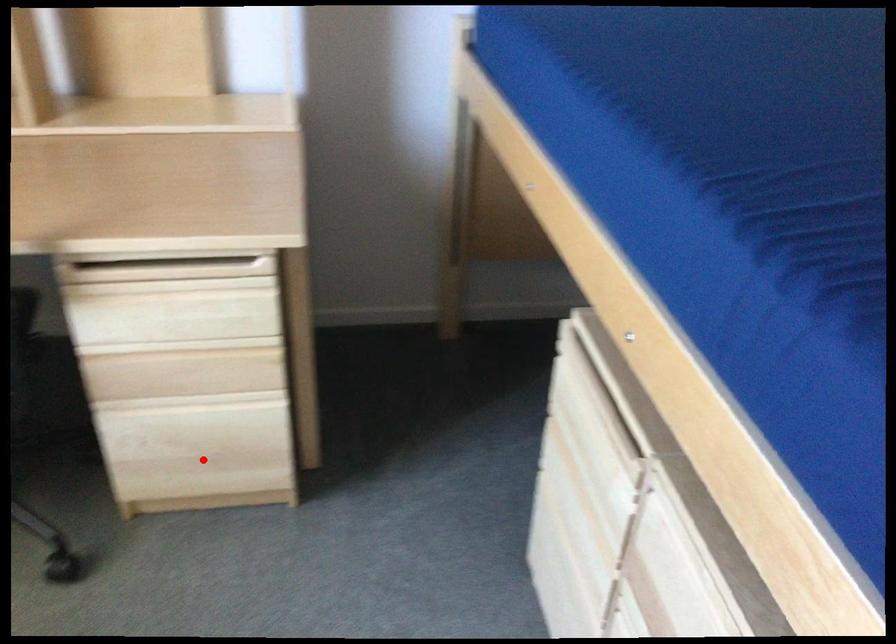
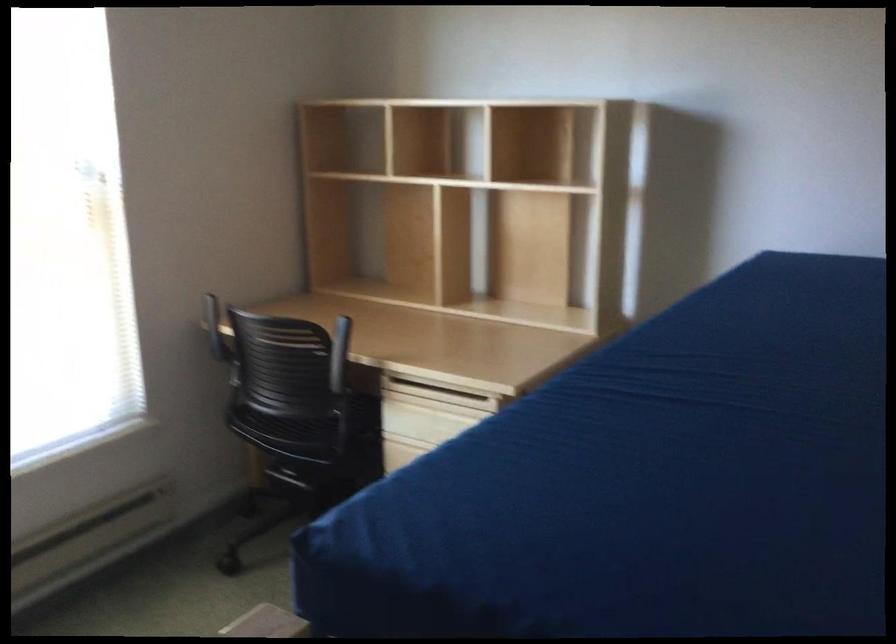
Question: I am providing you with two images of the same scene from different viewpoints. A red point is marked on the first image. Is the red point's position out of view in image 2?

Choices:
 (A) Yes
 (B) No

Answer: (A)